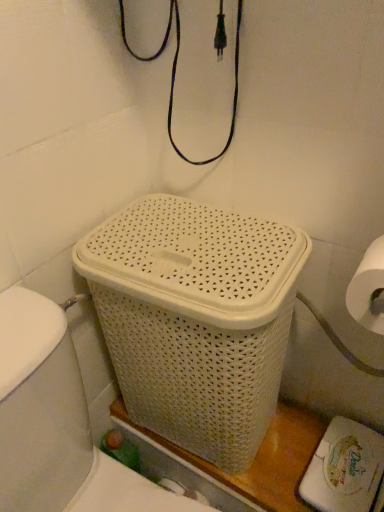
Question: Should I look upward or downward to see white woven laundry basket at center?

Choices:
 (A) down
 (B) up

Answer: (A)

Question: Is white woven laundry basket at center wider than white woven basket at center?

Choices:
 (A) yes
 (B) no

Answer: (A)

Question: Is white woven laundry basket at center outside white woven basket at center?

Choices:
 (A) no
 (B) yes

Answer: (B)

Question: From the image's perspective, is white woven laundry basket at center located beneath white woven basket at center?

Choices:
 (A) yes
 (B) no

Answer: (A)

Question: From a real-world perspective, is white woven laundry basket at center below white woven basket at center?

Choices:
 (A) yes
 (B) no

Answer: (A)

Question: Are white woven laundry basket at center and white woven basket at center far apart?

Choices:
 (A) yes
 (B) no

Answer: (B)

Question: Considering the relative positions of white woven laundry basket at center and white woven basket at center in the image provided, is white woven laundry basket at center to the right of white woven basket at center from the viewer's perspective?

Choices:
 (A) yes
 (B) no

Answer: (B)

Question: Considering the relative positions of white woven basket at center and white woven laundry basket at center in the image provided, is white woven basket at center to the right of white woven laundry basket at center from the viewer's perspective?

Choices:
 (A) no
 (B) yes

Answer: (B)

Question: Is white woven basket at center smaller than white woven laundry basket at center?

Choices:
 (A) yes
 (B) no

Answer: (A)

Question: Is white woven basket at center to the left of white woven laundry basket at center from the viewer's perspective?

Choices:
 (A) no
 (B) yes

Answer: (A)

Question: Are white woven basket at center and white woven laundry basket at center far apart?

Choices:
 (A) yes
 (B) no

Answer: (B)

Question: From the image's perspective, is white woven basket at center located beneath white woven laundry basket at center?

Choices:
 (A) yes
 (B) no

Answer: (B)

Question: Is white woven basket at center not inside white woven laundry basket at center?

Choices:
 (A) no
 (B) yes

Answer: (B)

Question: From the image's perspective, is white woven basket at center located above or below white woven laundry basket at center?

Choices:
 (A) above
 (B) below

Answer: (A)